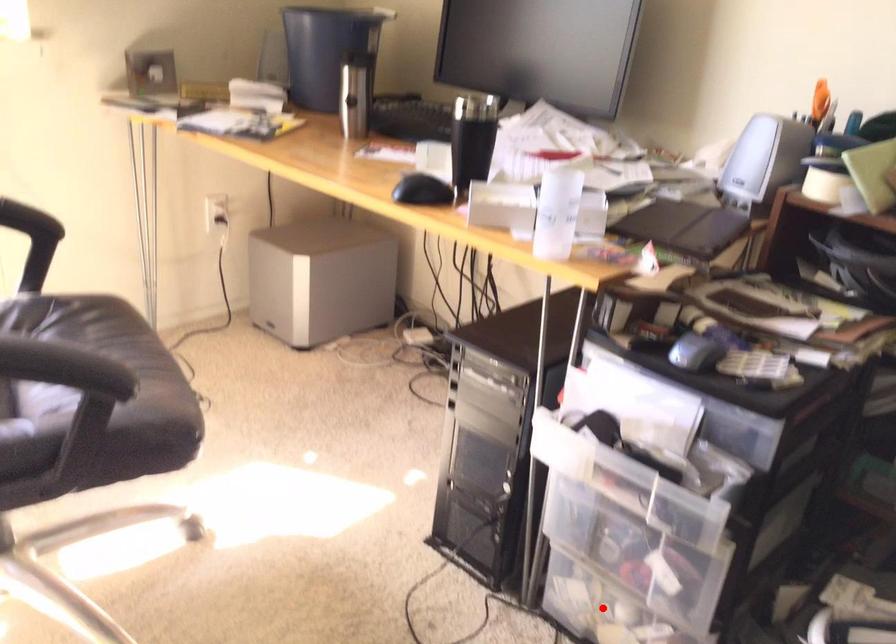
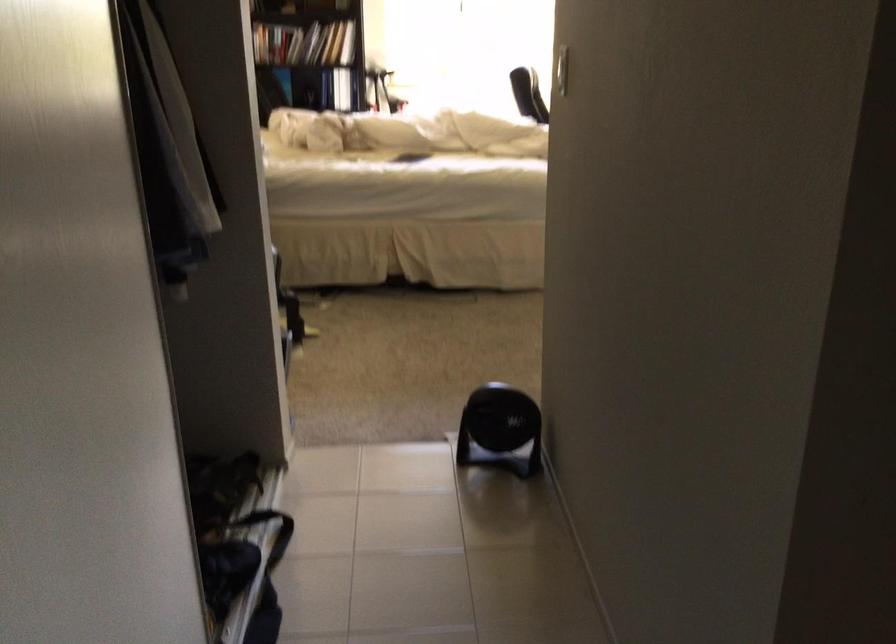
Question: I am providing you with two images of the same scene from different viewpoints. A red point is marked on the first image. Can you still see the location of the red point in image 2?

Choices:
 (A) Yes
 (B) No

Answer: (B)